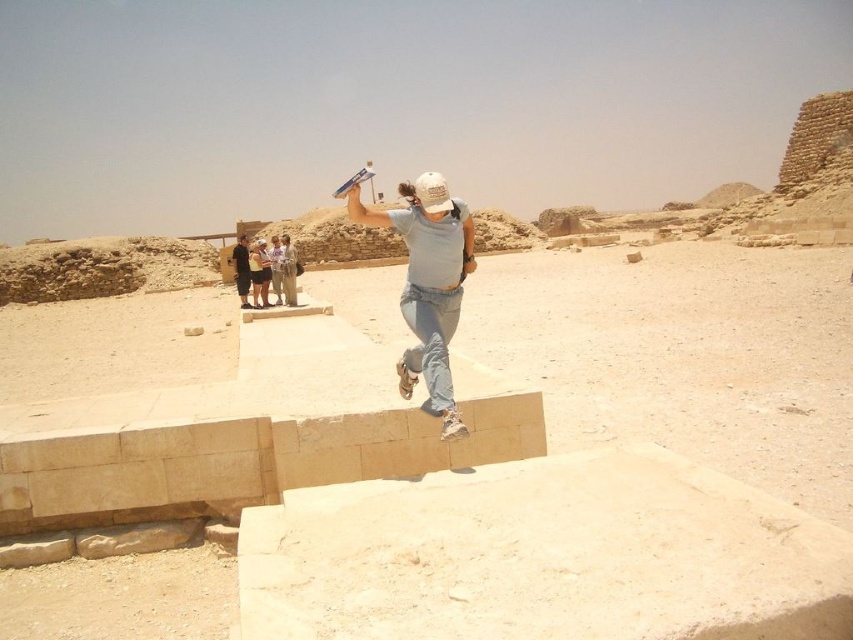
Based on the scene description, which object is bigger between the light blue denim jeans at center and the light brown fabric shirt at center?

The light blue denim jeans at center is larger in size than the light brown fabric shirt at center according to the description.

Based on the coordinates provided, where is the light blue denim jeans at center located in the image?

The light blue denim jeans at center is located at the coordinates point (x=428, y=284).

You are a photographer trying to capture a clear photo of the light blue denim jeans at center and the light brown fabric shirt at center. Which object will appear larger in the photo?

The light blue denim jeans at center will appear larger in the photo because it is in front of the light brown fabric shirt at center, making it closer to the camera.